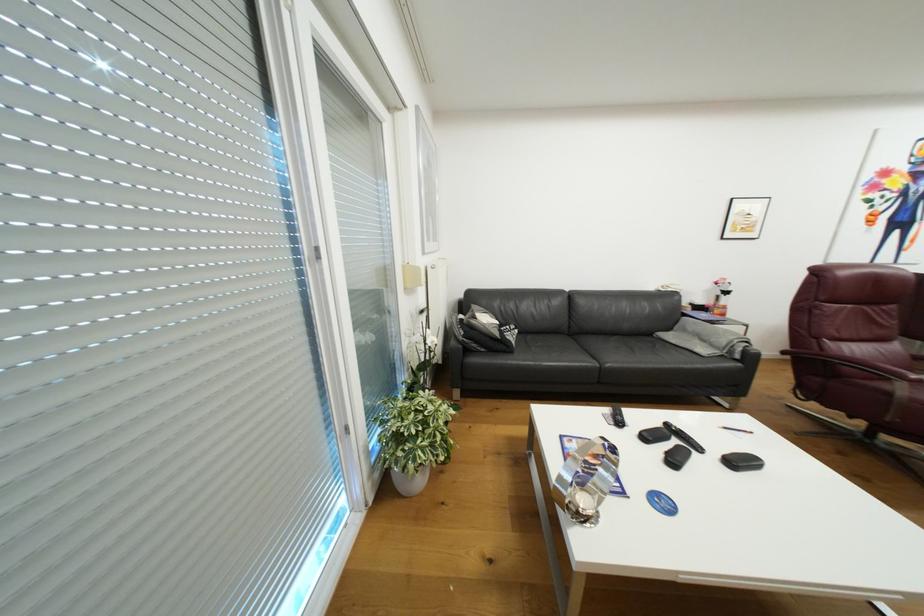
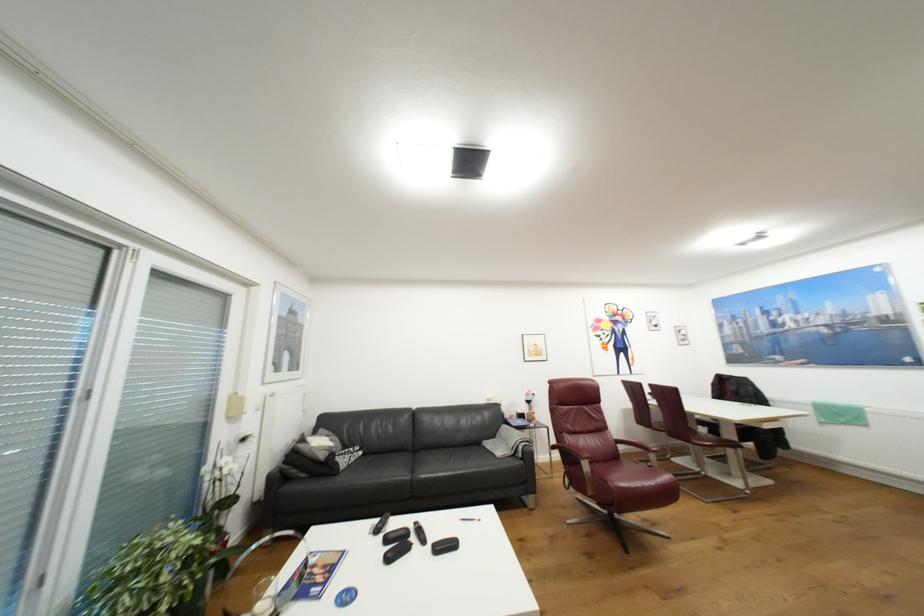
Find the pixel in the second image that matches [675,329] in the first image.

(500, 437)